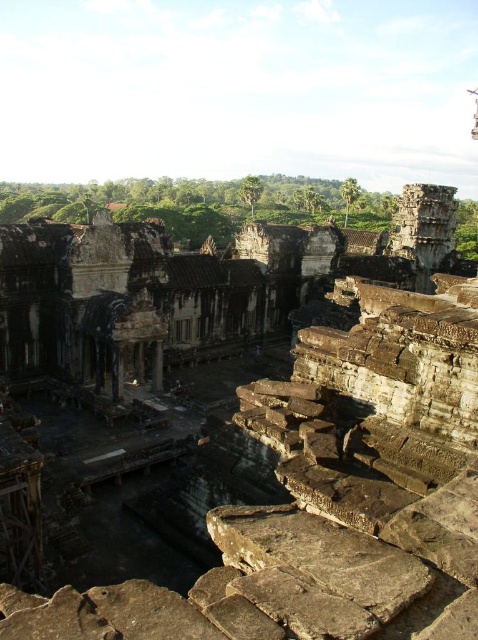
Question: Can you confirm if brown stone ruins at center is thinner than brown stone pillar at center?

Choices:
 (A) yes
 (B) no

Answer: (B)

Question: Which of the following is the farthest from the observer?

Choices:
 (A) (160, 348)
 (B) (326, 579)

Answer: (A)

Question: Where is brown stone ruins at center located in relation to brown stone pillar at center in the image?

Choices:
 (A) below
 (B) above

Answer: (B)

Question: Is brown stone ruins at center further to camera compared to brown stone pillar at center?

Choices:
 (A) no
 (B) yes

Answer: (A)

Question: Which point is closer to the camera?

Choices:
 (A) brown stone pillar at center
 (B) brown stone ruins at center

Answer: (B)

Question: Which of the following is the farthest from the observer?

Choices:
 (A) brown stone ruins at center
 (B) brown stone pillar at center

Answer: (B)